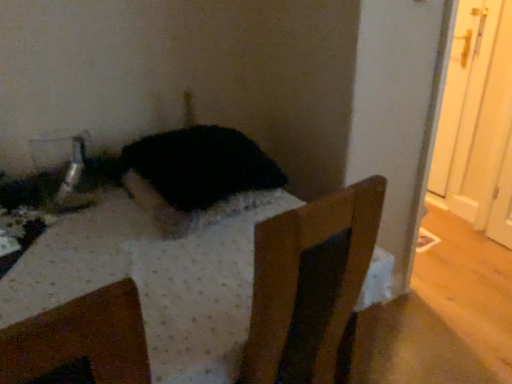
Question: Visually, is black fur cat at center positioned to the left or to the right of wooden chair at center?

Choices:
 (A) right
 (B) left

Answer: (A)

Question: Looking at the image, does black fur cat at center seem bigger or smaller compared to wooden chair at center?

Choices:
 (A) big
 (B) small

Answer: (B)

Question: Is black fur cat at center wider or thinner than wooden chair at center?

Choices:
 (A) wide
 (B) thin

Answer: (B)

Question: Looking at their shapes, would you say wooden chair at center is wider or thinner than black fur cat at center?

Choices:
 (A) thin
 (B) wide

Answer: (B)

Question: Considering the relative positions of wooden chair at center and black fur cat at center in the image provided, is wooden chair at center to the left or to the right of black fur cat at center?

Choices:
 (A) left
 (B) right

Answer: (A)

Question: From the image's perspective, is wooden chair at center positioned above or below black fur cat at center?

Choices:
 (A) below
 (B) above

Answer: (A)

Question: In the image, is wooden chair at center positioned in front of or behind black fur cat at center?

Choices:
 (A) front
 (B) behind

Answer: (A)